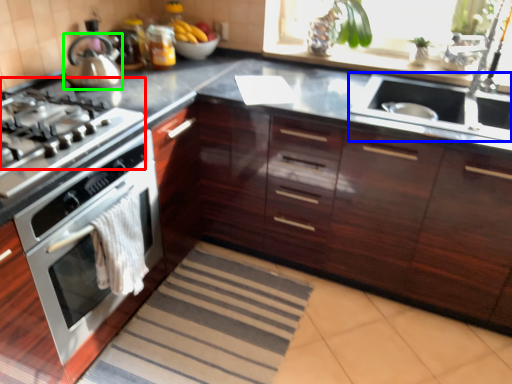
Question: Which object is the farthest from gas stove (highlighted by a red box)? Choose among these: sink (highlighted by a blue box) or kitchen appliance (highlighted by a green box).

Choices:
 (A) sink
 (B) kitchen appliance

Answer: (A)